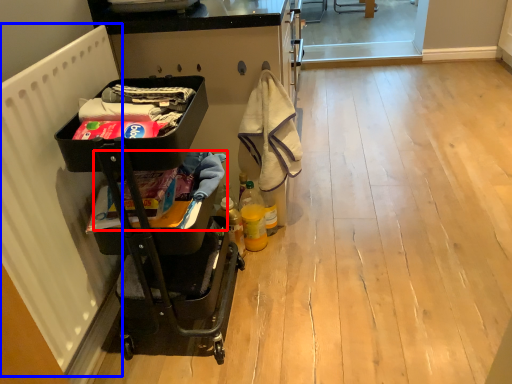
Question: Which of the following is the closest to the observer, laundry (highlighted by a red box) or radiator (highlighted by a blue box)?

Choices:
 (A) laundry
 (B) radiator

Answer: (B)